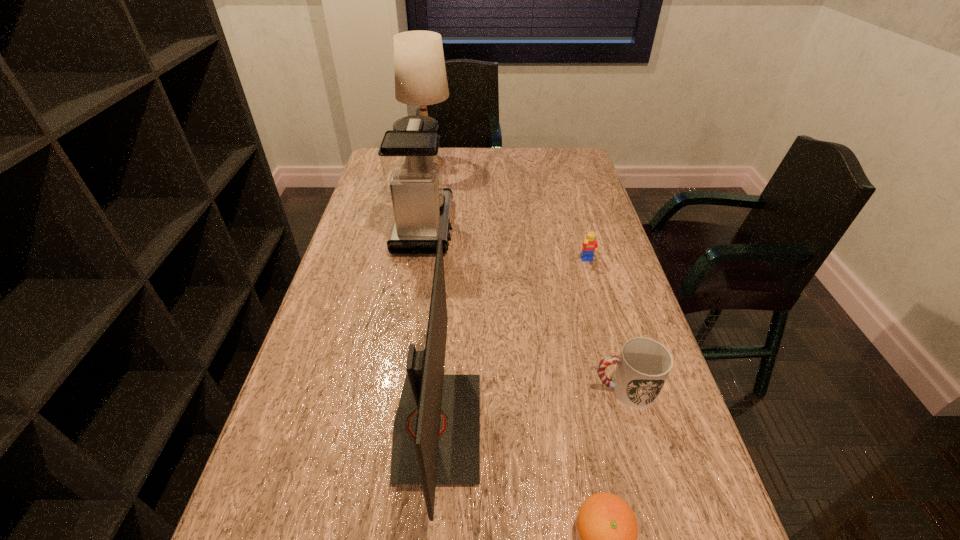
The image size is (960, 540). Find the location of `the farthest object`. the farthest object is located at coordinates (420, 75).

The image size is (960, 540). Find the location of `the tallest object`. the tallest object is located at coordinates (420, 75).

I want to click on coffee maker, so click(409, 155).

In order to click on the third shortest object in this screenshot , I will do `click(643, 366)`.

Find the location of a particular element. This screenshot has height=540, width=960. Lego is located at coordinates (589, 246).

Identify the location of free space located 0.340m on the right of the lamp. (542, 163).

This screenshot has height=540, width=960. Identify the location of free space located at the front of the coffee maker where the controls are located. (508, 227).

Find the location of a particular element. vacant space located 0.290m on the handle side of the third shortest object is located at coordinates (454, 389).

This screenshot has height=540, width=960. Identify the location of free space located on the handle side of the third shortest object. (544, 389).

Locate an element on the screen. The width and height of the screenshot is (960, 540). vacant area situated on the handle side of the third shortest object is located at coordinates (407, 389).